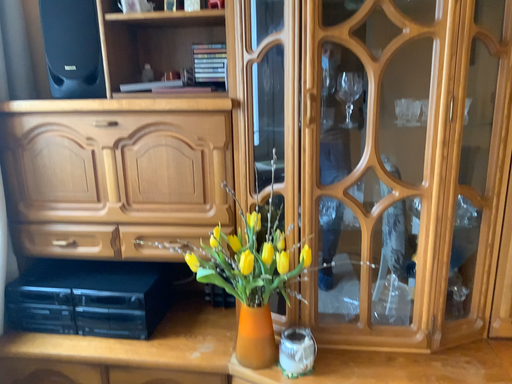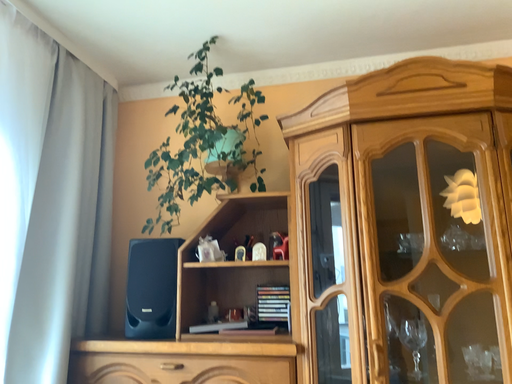
Question: How did the camera likely rotate when shooting the video?

Choices:
 (A) rotated upward
 (B) rotated downward

Answer: (A)